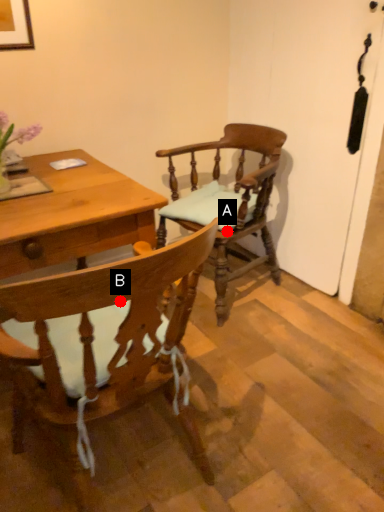
Question: Two points are circled on the image, labeled by A and B beside each circle. Which of the following is the farthest from the observer?

Choices:
 (A) A is further
 (B) B is further

Answer: (A)